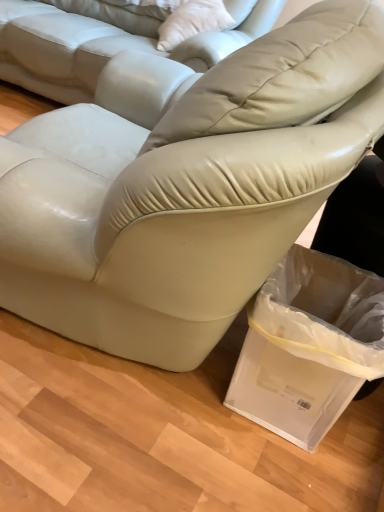
Question: Is matte leather couch at center, positioned as the first studio couch in bottom-to-top order, spatially inside satin beige leather couch at center, acting as the first studio couch starting from the top, or outside of it?

Choices:
 (A) inside
 (B) outside

Answer: (B)

Question: Considering the positions of point (8, 140) and point (235, 48), is point (8, 140) closer or farther from the camera than point (235, 48)?

Choices:
 (A) farther
 (B) closer

Answer: (B)

Question: Estimate the real-world distances between objects in this image. Which object is farther from the satin beige leather couch at center, acting as the first studio couch starting from the top?

Choices:
 (A) clear plastic bag at lower right
 (B) white leather pillow at upper center
 (C) matte leather couch at center, the second studio couch viewed from the top

Answer: (A)

Question: Considering the real-world distances, which object is closest to the matte leather couch at center, positioned as the first studio couch in bottom-to-top order?

Choices:
 (A) satin beige leather couch at center, acting as the first studio couch starting from the top
 (B) clear plastic bag at lower right
 (C) white leather pillow at upper center

Answer: (B)